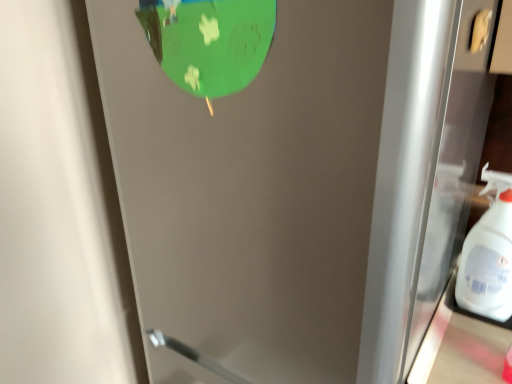
Describe the element at coordinates (489, 255) in the screenshot. The image size is (512, 384). I see `white plastic spray bottle at right` at that location.

Where is `white plastic spray bottle at right`? white plastic spray bottle at right is located at coordinates (489, 255).

This screenshot has width=512, height=384. Describe the element at coordinates (279, 190) in the screenshot. I see `satin silver refrigerator at center` at that location.

Where is `satin silver refrigerator at center`? satin silver refrigerator at center is located at coordinates (279, 190).

Identify the location of white plastic spray bottle at right. Image resolution: width=512 pixels, height=384 pixels. (489, 255).

Considering the relative positions of satin silver refrigerator at center and white plastic spray bottle at right in the image provided, is satin silver refrigerator at center to the right of white plastic spray bottle at right from the viewer's perspective?

Incorrect, satin silver refrigerator at center is not on the right side of white plastic spray bottle at right.

Is satin silver refrigerator at center closer to camera compared to white plastic spray bottle at right?

Yes, satin silver refrigerator at center is in front of white plastic spray bottle at right.

Which is closer to the camera, (116, 30) or (492, 263)?

Point (116, 30) is closer to the camera than point (492, 263).

From the image's perspective, is satin silver refrigerator at center on top of white plastic spray bottle at right?

No, from the image's perspective, satin silver refrigerator at center is not over white plastic spray bottle at right.

From a real-world perspective, which object rests below the other?

satin silver refrigerator at center, from a real-world perspective.

Considering the sizes of satin silver refrigerator at center and white plastic spray bottle at right in the image, is satin silver refrigerator at center wider or thinner than white plastic spray bottle at right?

Considering their sizes, satin silver refrigerator at center looks broader than white plastic spray bottle at right.

Does satin silver refrigerator at center have a greater height compared to white plastic spray bottle at right?

Yes, satin silver refrigerator at center is taller than white plastic spray bottle at right.

Based on their sizes in the image, would you say satin silver refrigerator at center is bigger or smaller than white plastic spray bottle at right?

Clearly, satin silver refrigerator at center is larger in size than white plastic spray bottle at right.

Do you think satin silver refrigerator at center is within white plastic spray bottle at right, or outside of it?

satin silver refrigerator at center lies outside white plastic spray bottle at right.

Is satin silver refrigerator at center in contact with white plastic spray bottle at right?

No.

Does satin silver refrigerator at center turn towards white plastic spray bottle at right?

No, satin silver refrigerator at center is not aimed at white plastic spray bottle at right.

What's the angular difference between satin silver refrigerator at center and white plastic spray bottle at right's facing directions?

satin silver refrigerator at center and white plastic spray bottle at right are facing 0.00105 degrees away from each other.

You are a GUI agent. You are given a task and a screenshot of the screen. Output one action in this format:
    pyautogui.click(x=<x>, y=<y>)
    Task: Click on the door that is below the white plastic spray bottle at right (from the image's perspective)
    Image resolution: width=512 pixels, height=384 pixels.
    Given the screenshot: What is the action you would take?
    pyautogui.click(x=279, y=190)

Considering the relative positions of white plastic spray bottle at right and satin silver refrigerator at center in the image provided, is white plastic spray bottle at right to the left or to the right of satin silver refrigerator at center?

In the image, white plastic spray bottle at right appears on the right side of satin silver refrigerator at center.

Considering their positions, is white plastic spray bottle at right located in front of or behind satin silver refrigerator at center?

Clearly, white plastic spray bottle at right is behind satin silver refrigerator at center.

Is point (462, 300) closer to viewer compared to point (249, 246)?

No, (462, 300) is behind (249, 246).

From the picture: From the image's perspective, would you say white plastic spray bottle at right is shown under satin silver refrigerator at center?

Incorrect, from the image's perspective, white plastic spray bottle at right is higher than satin silver refrigerator at center.

From a real-world perspective, does white plastic spray bottle at right stand above satin silver refrigerator at center?

Yes, from a real-world perspective, white plastic spray bottle at right is above satin silver refrigerator at center.

Which object is wider, white plastic spray bottle at right or satin silver refrigerator at center?

satin silver refrigerator at center is wider.

Is white plastic spray bottle at right shorter than satin silver refrigerator at center?

Correct, white plastic spray bottle at right is not as tall as satin silver refrigerator at center.

Is white plastic spray bottle at right bigger than satin silver refrigerator at center?

No.

Would you say white plastic spray bottle at right is inside or outside satin silver refrigerator at center?

white plastic spray bottle at right lies outside satin silver refrigerator at center.

Is white plastic spray bottle at right placed right next to satin silver refrigerator at center?

white plastic spray bottle at right and satin silver refrigerator at center are clearly separated.

Is white plastic spray bottle at right oriented towards satin silver refrigerator at center?

No, white plastic spray bottle at right is not aimed at satin silver refrigerator at center.

This screenshot has height=384, width=512. Find the location of `cleaning product on the right of satin silver refrigerator at center`. cleaning product on the right of satin silver refrigerator at center is located at coordinates pos(489,255).

The image size is (512, 384). Identify the location of door in front of the white plastic spray bottle at right. (279, 190).

At what (x,y) coordinates should I click in order to perform the action: click on cleaning product behind the satin silver refrigerator at center. Please return your answer as a coordinate pair (x, y). The width and height of the screenshot is (512, 384). Looking at the image, I should click on (489, 255).